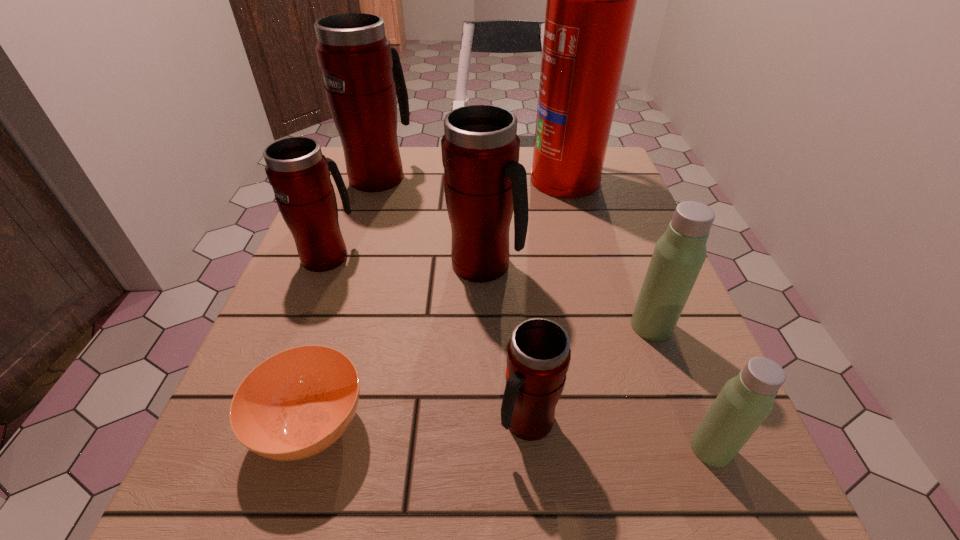
In order to click on free space that is in between the fourth farthest thermos bottle and the farthest red thermos bottle in this screenshot , I will do `click(516, 251)`.

Locate an element on the screen. empty space between the smaller light thermos bottle and the tallest thermos bottle is located at coordinates (545, 312).

The width and height of the screenshot is (960, 540). Find the location of `free spot between the smallest red thermos bottle and the fourth nearest object`. free spot between the smallest red thermos bottle and the fourth nearest object is located at coordinates (589, 374).

At what (x,y) coordinates should I click in order to perform the action: click on free spot between the nearest red thermos bottle and the fire extinguisher. Please return your answer as a coordinate pair (x, y). The image size is (960, 540). Looking at the image, I should click on (545, 300).

At what (x,y) coordinates should I click in order to perform the action: click on vacant region between the third biggest red thermos bottle and the nearest red thermos bottle. Please return your answer as a coordinate pair (x, y). The image size is (960, 540). Looking at the image, I should click on (427, 339).

The width and height of the screenshot is (960, 540). I want to click on blank region between the third smallest red thermos bottle and the seventh shortest object, so click(432, 221).

The width and height of the screenshot is (960, 540). Identify the location of object that is the seventh closest to the smaller light thermos bottle. (362, 72).

This screenshot has height=540, width=960. Identify the location of the sixth closest object to the second smallest red thermos bottle. (679, 254).

Select which thermos bottle appears as the fourth closest to the second tallest thermos bottle. Please provide its 2D coordinates. Your answer should be formatted as a tuple, i.e. [(x, y)], where the tuple contains the x and y coordinates of a point satisfying the conditions above.

[(538, 355)]

Locate which thermos bottle is the fifth closest to the nearest red thermos bottle. Please provide its 2D coordinates. Your answer should be formatted as a tuple, i.e. [(x, y)], where the tuple contains the x and y coordinates of a point satisfying the conditions above.

[(362, 72)]